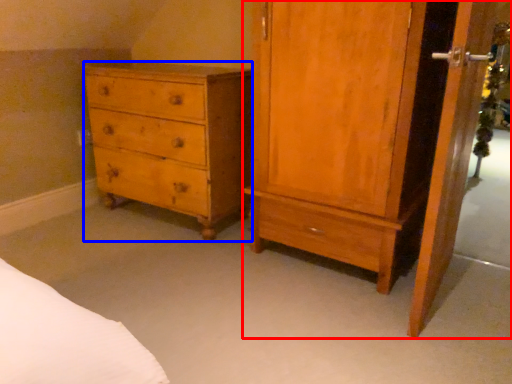
Question: Which object appears closest to the camera in this image, nightstand (highlighted by a red box) or chest of drawers (highlighted by a blue box)?

Choices:
 (A) nightstand
 (B) chest of drawers

Answer: (A)